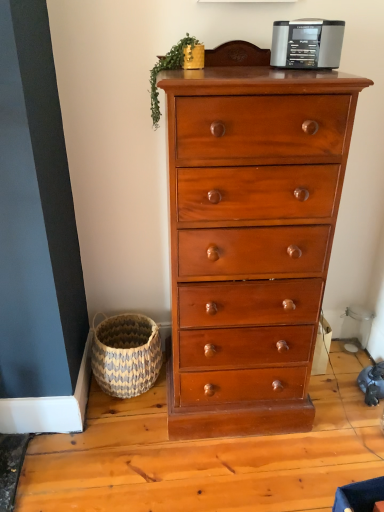
Question: From a real-world perspective, relative to shiny brown wood chest of drawers at center, is metallic gray radio at upper center vertically above or below?

Choices:
 (A) above
 (B) below

Answer: (A)

Question: Considering the positions of point (296, 35) and point (294, 320), is point (296, 35) closer or farther from the camera than point (294, 320)?

Choices:
 (A) closer
 (B) farther

Answer: (A)

Question: Which object is the closest to the shiny brown wood chest of drawers at center?

Choices:
 (A) woven natural basket at lower left
 (B) green leafy plant at upper center
 (C) metallic gray radio at upper center

Answer: (A)

Question: Which object is positioned farthest from the shiny brown wood chest of drawers at center?

Choices:
 (A) woven natural basket at lower left
 (B) green leafy plant at upper center
 (C) metallic gray radio at upper center

Answer: (B)